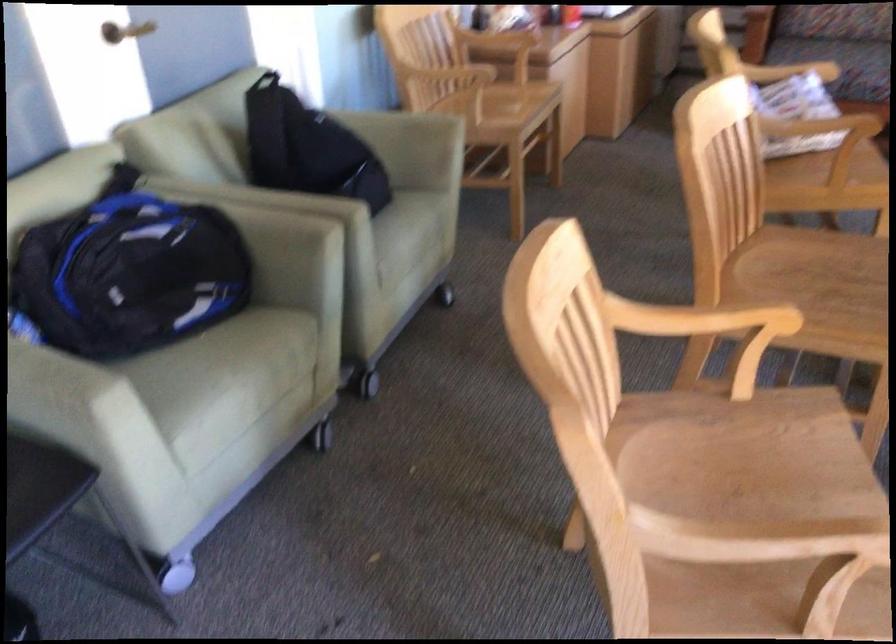
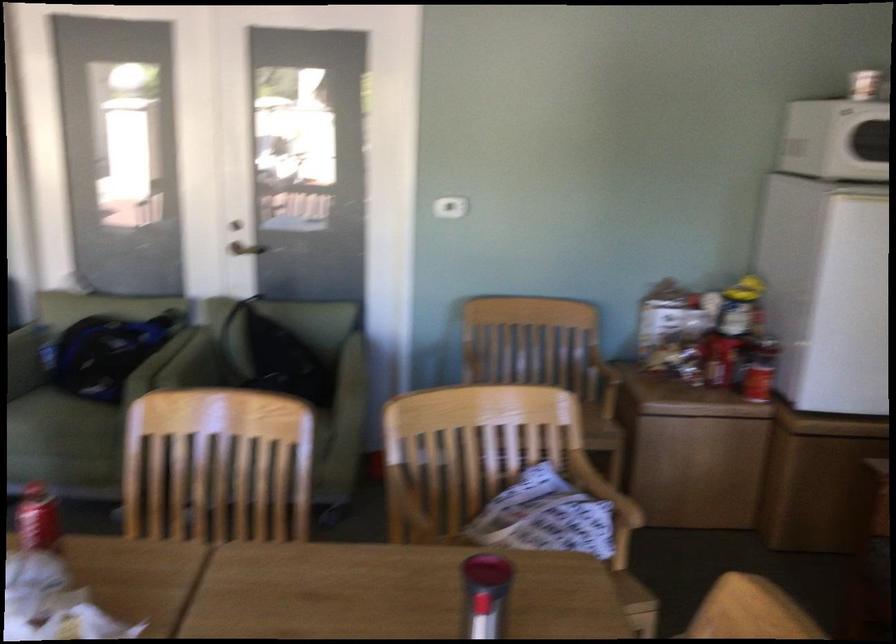
Question: I am providing you with two images of the same scene from different viewpoints. Which of the following objects are not visible in image2?

Choices:
 (A) sofa sitting surface
 (B) recessed silver handle
 (C) wooden chair sitting surface
 (D) black backpack

Answer: (D)